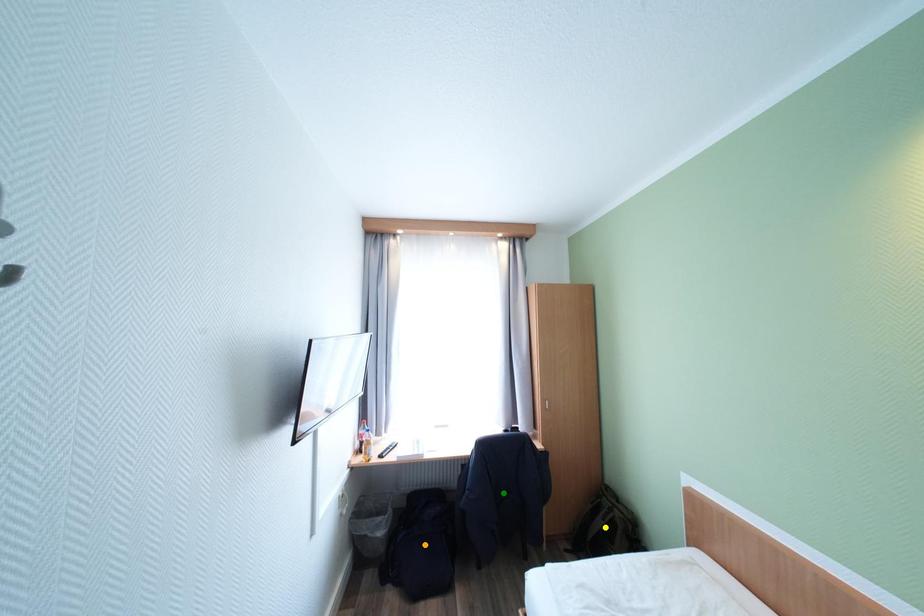
Order these from nearest to farthest:
yellow point
green point
orange point

yellow point
green point
orange point